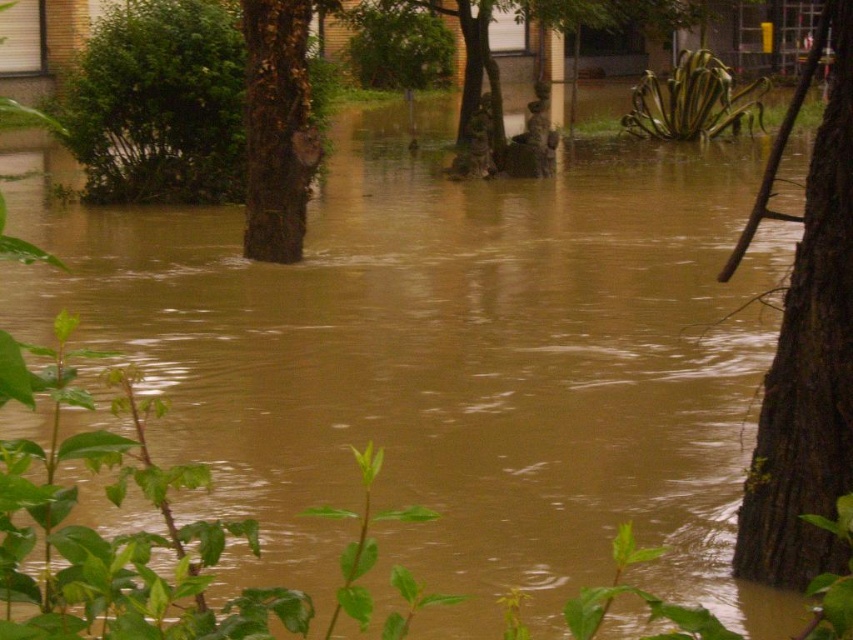
Question: Which object appears closest to the camera in this image?

Choices:
 (A) brown rough bark tree at center
 (B) brown rough bark tree at right

Answer: (B)

Question: Which of the following is the closest to the observer?

Choices:
 (A) brown rough bark tree at center
 (B) brown rough bark tree at right

Answer: (B)

Question: Is brown rough bark tree at right above brown rough bark tree at center?

Choices:
 (A) no
 (B) yes

Answer: (A)

Question: Considering the real-world distances, which object is closest to the green leafy bush at upper left?

Choices:
 (A) brown rough bark tree at center
 (B) brown rough bark tree at right

Answer: (A)

Question: Is brown rough bark tree at right smaller than green leafy bush at upper left?

Choices:
 (A) yes
 (B) no

Answer: (A)

Question: Can you confirm if brown rough bark tree at right is wider than green leafy bush at upper left?

Choices:
 (A) yes
 (B) no

Answer: (B)